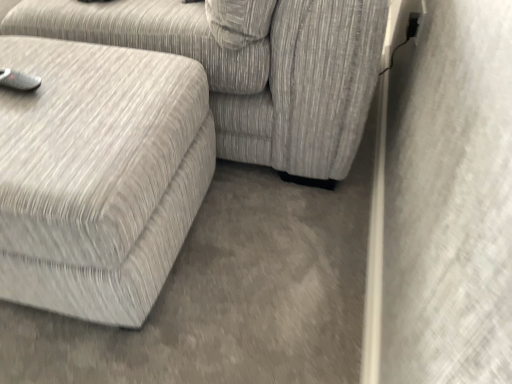
Question: Is textured gray ottoman at left, the 2th studio couch in the top-to-bottom sequence, wider or thinner than textured gray fabric couch at lower left, marked as the 1th studio couch in a top-to-bottom arrangement?

Choices:
 (A) wide
 (B) thin

Answer: (B)

Question: From the image's perspective, relative to textured gray fabric couch at lower left, marked as the 1th studio couch in a top-to-bottom arrangement, is textured gray ottoman at left, the 2th studio couch in the top-to-bottom sequence, above or below?

Choices:
 (A) above
 (B) below

Answer: (B)

Question: Based on their sizes in the image, would you say textured gray ottoman at left, which is the 1th studio couch in bottom-to-top order, is bigger or smaller than textured gray fabric couch at lower left, marked as the 2th studio couch in a bottom-to-top arrangement?

Choices:
 (A) small
 (B) big

Answer: (A)

Question: Is textured gray fabric couch at lower left, marked as the 2th studio couch in a bottom-to-top arrangement, spatially inside textured gray ottoman at left, which is the 1th studio couch in bottom-to-top order, or outside of it?

Choices:
 (A) outside
 (B) inside

Answer: (A)

Question: Considering the positions of textured gray fabric couch at lower left, marked as the 2th studio couch in a bottom-to-top arrangement, and textured gray ottoman at left, the 2th studio couch in the top-to-bottom sequence, in the image, is textured gray fabric couch at lower left, marked as the 2th studio couch in a bottom-to-top arrangement, wider or thinner than textured gray ottoman at left, the 2th studio couch in the top-to-bottom sequence,?

Choices:
 (A) thin
 (B) wide

Answer: (B)

Question: Based on their sizes in the image, would you say textured gray fabric couch at lower left, marked as the 2th studio couch in a bottom-to-top arrangement, is bigger or smaller than textured gray ottoman at left, the 2th studio couch in the top-to-bottom sequence?

Choices:
 (A) big
 (B) small

Answer: (A)

Question: In the image, is textured gray fabric couch at lower left, marked as the 2th studio couch in a bottom-to-top arrangement, positioned in front of or behind textured gray ottoman at left, the 2th studio couch in the top-to-bottom sequence?

Choices:
 (A) behind
 (B) front

Answer: (A)